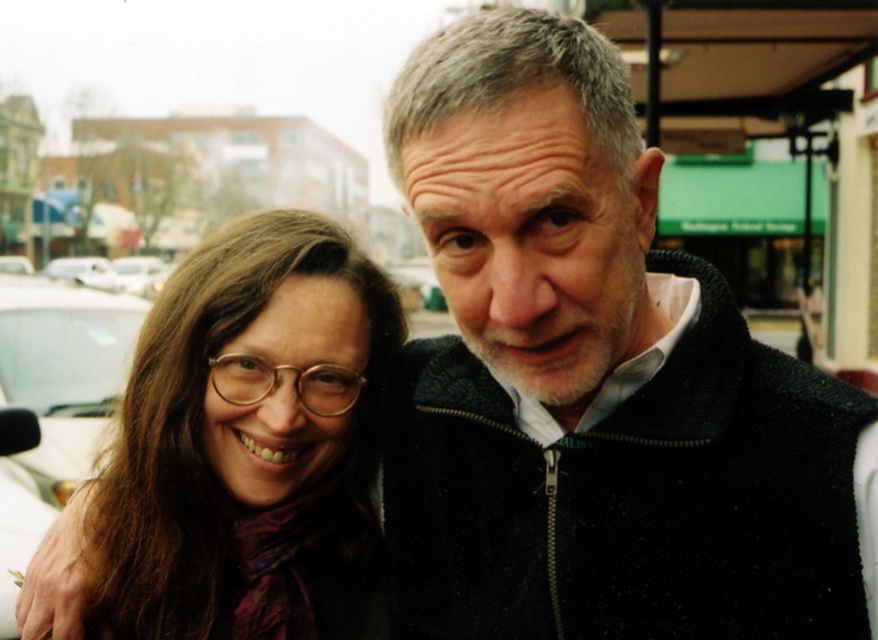
Between matte brown hair at center and white matte car at left, which one has less height?

Standing shorter between the two is white matte car at left.

Which is behind, point (306, 230) or point (91, 426)?

Positioned behind is point (91, 426).

The height and width of the screenshot is (640, 878). What do you see at coordinates (249, 444) in the screenshot? I see `matte brown hair at center` at bounding box center [249, 444].

The width and height of the screenshot is (878, 640). I want to click on matte brown hair at center, so click(x=249, y=444).